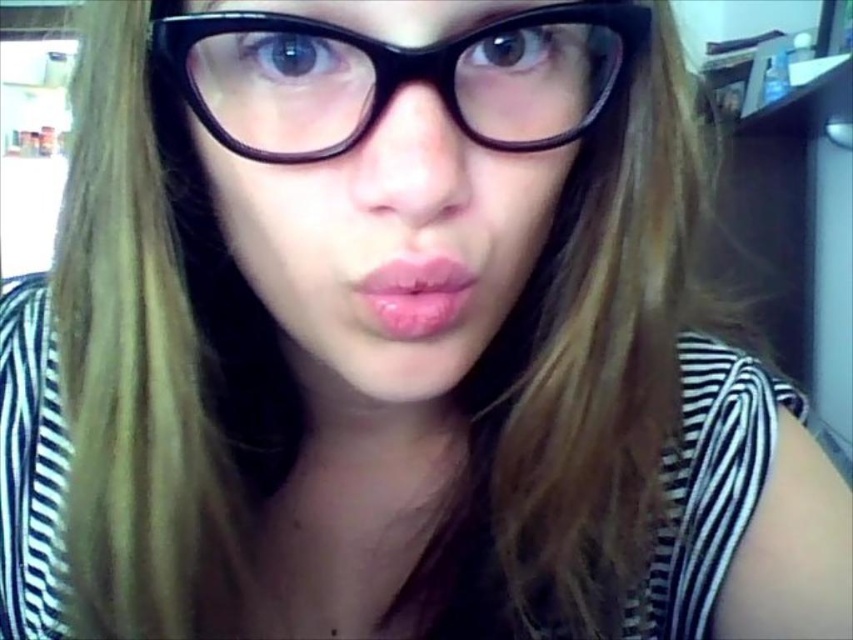
You are holding a 12 inch ruler and want to measure the distance from your eyes to the point at coordinates point (254, 257) in the image. Can you reach it with your ruler?

The distance between point (254, 257) and the viewer is 13.19 inches. Since the ruler is only 12 inches long, it is not long enough to measure the distance.

From the picture: You are standing in the room and want to move from the point at coordinates point [535,205] to the point at coordinates point [416,317]. Which direction should you move to reach the destination?

To move from point [535,205] to point [416,317], you should move northeast because the destination point has a higher x coordinate and a lower y coordinate, indicating a northeast direction.

You are a photographer adjusting the focus of your camera. You notice the black plastic glasses at center and the pink glossy lips at center in your frame. Which object should you focus on first if you want both to be in focus?

The black plastic glasses at center is in front of the pink glossy lips at center, so you should focus on the black plastic glasses at center first to ensure both are in focus.